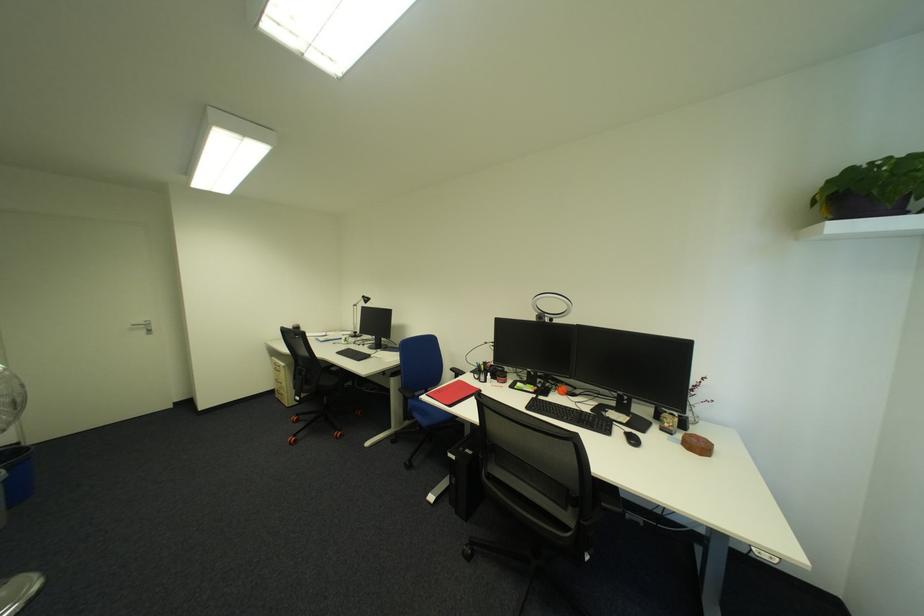
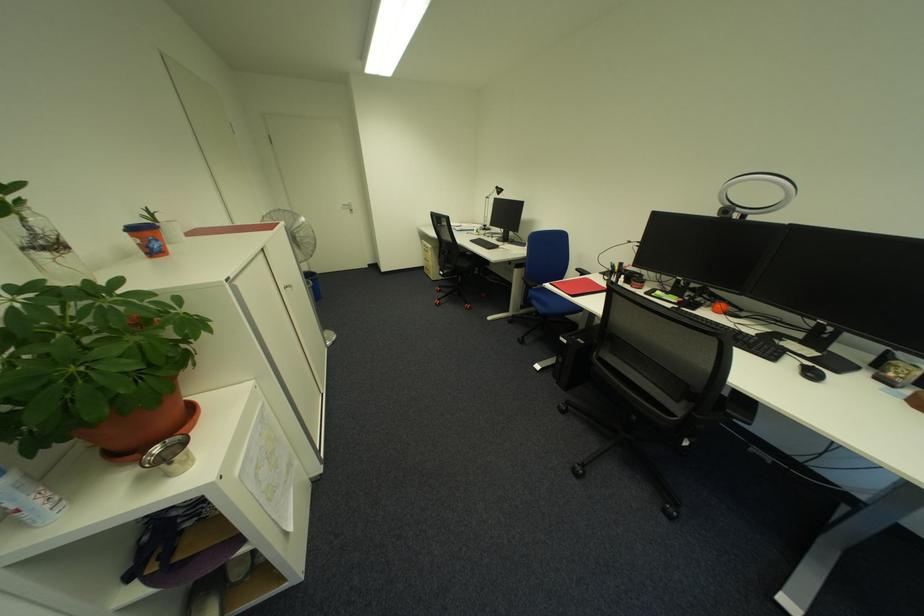
Where in the second image is the point corresponding to [590,528] from the first image?

(699, 419)